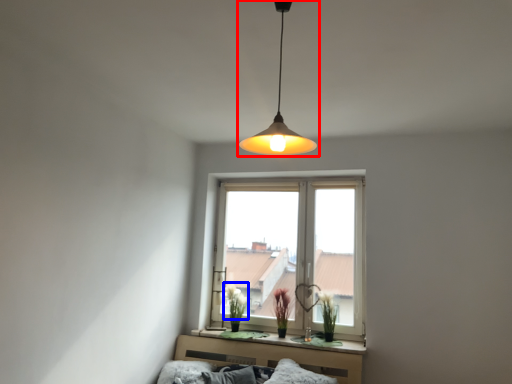
Question: Which object appears farthest to the camera in this image, lamp (highlighted by a red box) or flower (highlighted by a blue box)?

Choices:
 (A) lamp
 (B) flower

Answer: (B)